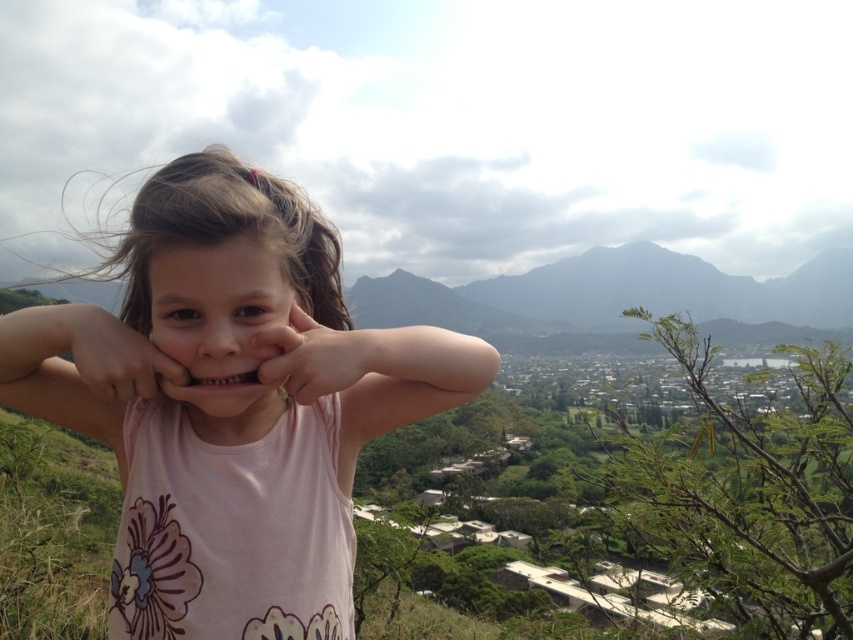
You are a photographer trying to capture the young girl in the scene. You want to ensure that both the matte pink shirt at center and the pink fabric hand at center are clearly visible in your shot. Given their positions, which object should you focus on first to ensure both are in frame?

Since the matte pink shirt at center is wider than the pink fabric hand at center, you should focus on the matte pink shirt at center first to ensure both are in frame.

You are a photographer trying to capture the matte pink shirt at center in your shot. Based on the scene description, where should you position your camera relative to the girl to ensure the shirt is in the frame?

The matte pink shirt at center is located at point (78, 368), so you should position your camera to focus on the coordinates (78, 368) to ensure the shirt is centered in the frame.

Based on the scene description, where is the smooth skin face at center located in terms of its 2D coordinates?

The smooth skin face at center is located at the 2D coordinates point (221, 326).